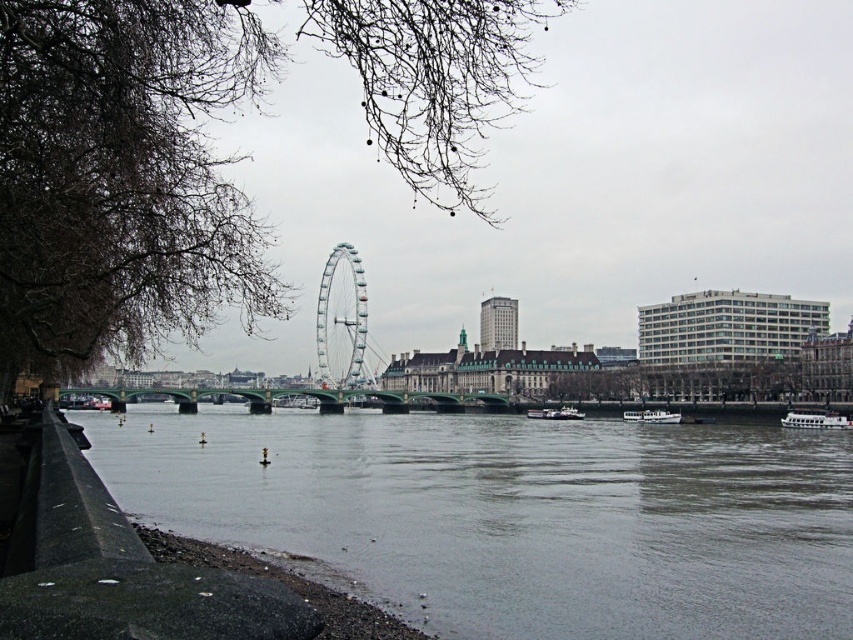
Is shiny metallic ferris wheel at center shorter than white glossy boat at center?

In fact, shiny metallic ferris wheel at center may be taller than white glossy boat at center.

Image resolution: width=853 pixels, height=640 pixels. Describe the element at coordinates (341, 317) in the screenshot. I see `shiny metallic ferris wheel at center` at that location.

Where is `shiny metallic ferris wheel at center`? This screenshot has height=640, width=853. shiny metallic ferris wheel at center is located at coordinates (341, 317).

What are the coordinates of `shiny metallic ferris wheel at center` in the screenshot? It's located at (341, 317).

Which is in front, point (744, 438) or point (804, 413)?

Point (744, 438) is in front.

In the scene shown: Can you confirm if gray concrete river at lower center is positioned below white glossy boat at lower right?

Yes.

Between point (636, 488) and point (825, 410), which one is positioned in front?

Point (636, 488)

Locate an element on the screen. The image size is (853, 640). gray concrete river at lower center is located at coordinates (514, 515).

Is white glossy boat at center bigger than white plastic boat at center?

Incorrect, white glossy boat at center is not larger than white plastic boat at center.

What do you see at coordinates (653, 417) in the screenshot? The height and width of the screenshot is (640, 853). I see `white glossy boat at center` at bounding box center [653, 417].

This screenshot has width=853, height=640. I want to click on white glossy boat at center, so click(x=653, y=417).